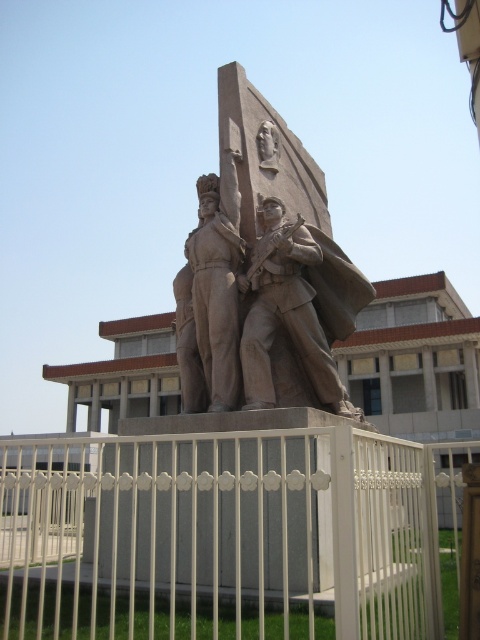
Who is more forward, (x=268, y=372) or (x=333, y=378)?

Point (x=268, y=372) is more forward.

Can you confirm if gray stone sculpture at center is shorter than stone statue at center?

In fact, gray stone sculpture at center may be taller than stone statue at center.

Describe the element at coordinates (267, 266) in the screenshot. I see `gray stone sculpture at center` at that location.

Locate an element on the screen. This screenshot has width=480, height=640. gray stone sculpture at center is located at coordinates (267, 266).

Is gray stone sculpture at center positioned in front of brown stone statue at center?

That is True.

Is point (214, 332) positioned before point (202, 244)?

Yes, it is.

At what (x,y) coordinates should I click in order to perform the action: click on gray stone sculpture at center. Please return your answer as a coordinate pair (x, y). The height and width of the screenshot is (640, 480). Looking at the image, I should click on click(x=267, y=266).

Who is lower down, stone statue at center or brown stone statue at center?

stone statue at center

Is point (357, 276) closer to viewer compared to point (196, 380)?

No, it is not.

Locate an element on the screen. This screenshot has height=640, width=480. stone statue at center is located at coordinates (298, 307).